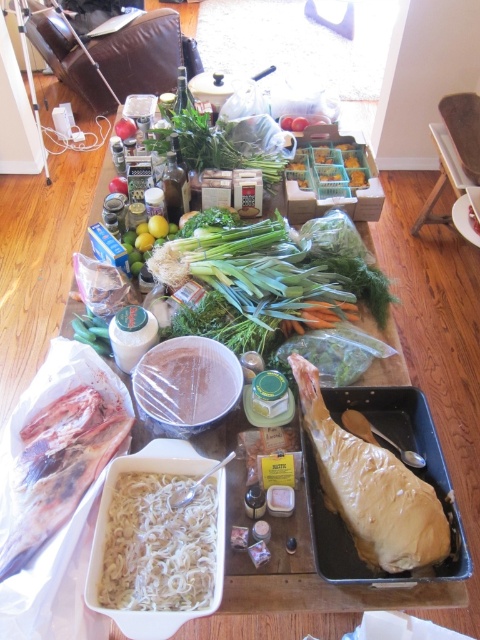
Question: Does golden brown parchment paper wrapped meat at center appear on the right side of frozen pinkish meat at lower left?

Choices:
 (A) yes
 (B) no

Answer: (A)

Question: Considering the real-world distances, which object is closest to the golden brown parchment paper wrapped meat at center?

Choices:
 (A) frozen pinkish meat at lower left
 (B) white matte noodles at center
 (C) green leafy at center

Answer: (B)

Question: Estimate the real-world distances between objects in this image. Which object is farther from the green leafy at center?

Choices:
 (A) frozen pinkish meat at lower left
 (B) golden brown parchment paper wrapped meat at center

Answer: (B)

Question: Which point is farther to the camera?

Choices:
 (A) (323, 454)
 (B) (104, 451)
 (C) (208, 548)
 (D) (80, 339)

Answer: (D)

Question: Can you confirm if frozen pinkish meat at lower left is positioned to the left of green leafy at center?

Choices:
 (A) yes
 (B) no

Answer: (A)

Question: Can you confirm if frozen pinkish meat at lower left is bigger than green leafy at center?

Choices:
 (A) no
 (B) yes

Answer: (B)